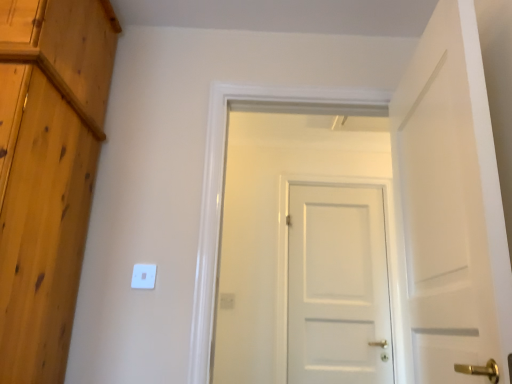
Question: Could you tell me if white plastic light switch at center is facing white matte door at center, arranged as the third door when viewed from the front?

Choices:
 (A) no
 (B) yes

Answer: (A)

Question: Is white plastic light switch at center oriented away from white matte door at center, positioned as the first door in back-to-front order?

Choices:
 (A) yes
 (B) no

Answer: (B)

Question: Can you confirm if white plastic light switch at center is smaller than white matte door at center, positioned as the first door in back-to-front order?

Choices:
 (A) yes
 (B) no

Answer: (A)

Question: Does white plastic light switch at center have a greater width compared to white matte door at center, positioned as the first door in back-to-front order?

Choices:
 (A) yes
 (B) no

Answer: (B)

Question: Does white plastic light switch at center lie in front of white matte door at center, positioned as the first door in back-to-front order?

Choices:
 (A) no
 (B) yes

Answer: (B)

Question: Does white plastic light switch at center have a larger size compared to white matte door at center, arranged as the third door when viewed from the front?

Choices:
 (A) no
 (B) yes

Answer: (A)

Question: From the image's perspective, would you say white matte door at center, the second door in the front-to-back sequence, is positioned over white plastic electric outlet at center?

Choices:
 (A) no
 (B) yes

Answer: (B)

Question: Is white matte door at center, the 2th door viewed from the back, next to white plastic electric outlet at center and touching it?

Choices:
 (A) no
 (B) yes

Answer: (A)

Question: Does white matte door at center, the 2th door viewed from the back, have a smaller size compared to white plastic electric outlet at center?

Choices:
 (A) yes
 (B) no

Answer: (B)

Question: Is white matte door at center, the second door in the front-to-back sequence, turned away from white plastic electric outlet at center?

Choices:
 (A) no
 (B) yes

Answer: (B)

Question: Is white matte door at center, the second door in the front-to-back sequence, far away from white plastic electric outlet at center?

Choices:
 (A) yes
 (B) no

Answer: (B)

Question: Does white matte door at center, the 2th door viewed from the back, have a greater width compared to white plastic electric outlet at center?

Choices:
 (A) yes
 (B) no

Answer: (A)

Question: From the image's perspective, is white plastic light switch at center under white plastic electric outlet at center?

Choices:
 (A) yes
 (B) no

Answer: (B)